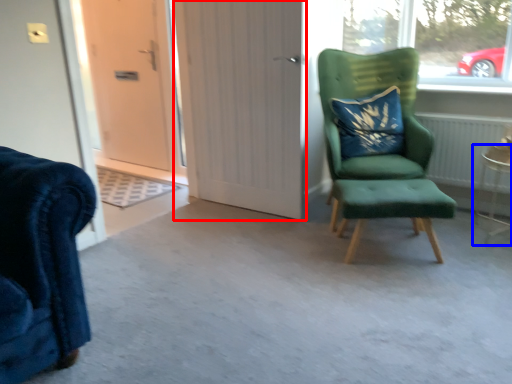
Question: Which of the following is the closest to the observer, door (highlighted by a red box) or side table (highlighted by a blue box)?

Choices:
 (A) door
 (B) side table

Answer: (B)